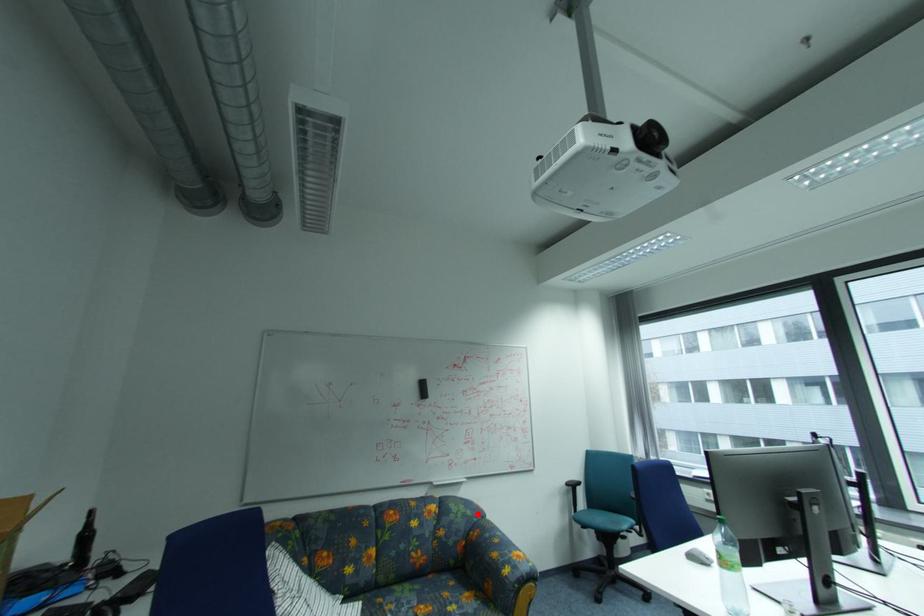
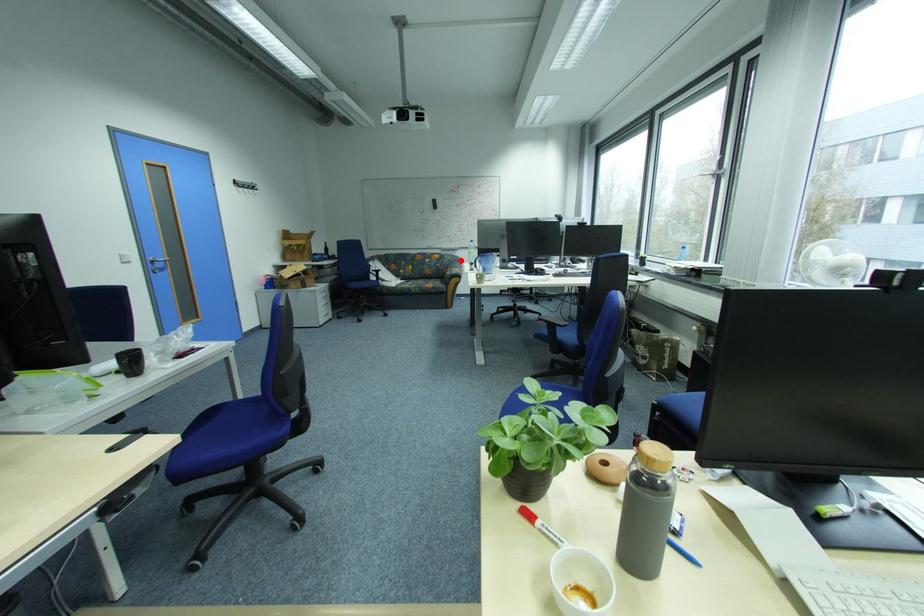
I am providing you with two images of the same scene from different viewpoints. A red point is marked on the first image and another point is marked on the second image. Does the point marked in image1 correspond to the same location as the one in image2?

Yes